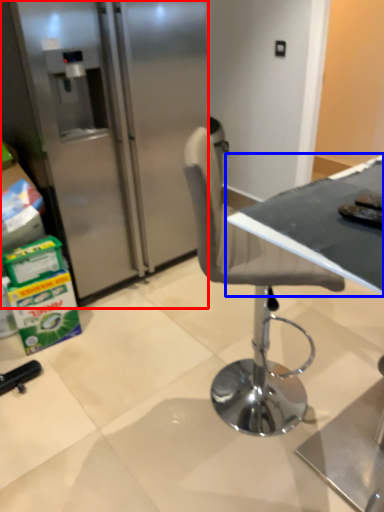
Question: Which object is further to the camera taking this photo, refrigerator (highlighted by a red box) or table (highlighted by a blue box)?

Choices:
 (A) refrigerator
 (B) table

Answer: (A)